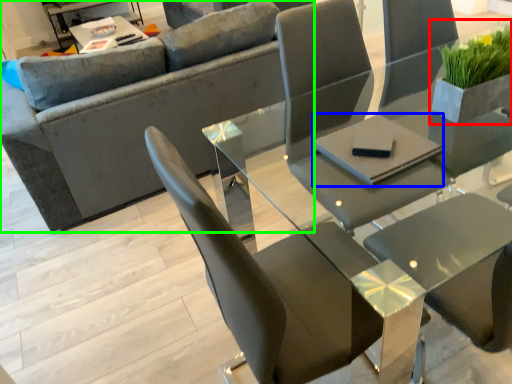
Question: Estimate the real-world distances between objects in this image. Which object is farther from houseplant (highlighted by a red box), pad (highlighted by a blue box) or studio couch (highlighted by a green box)?

Choices:
 (A) pad
 (B) studio couch

Answer: (B)